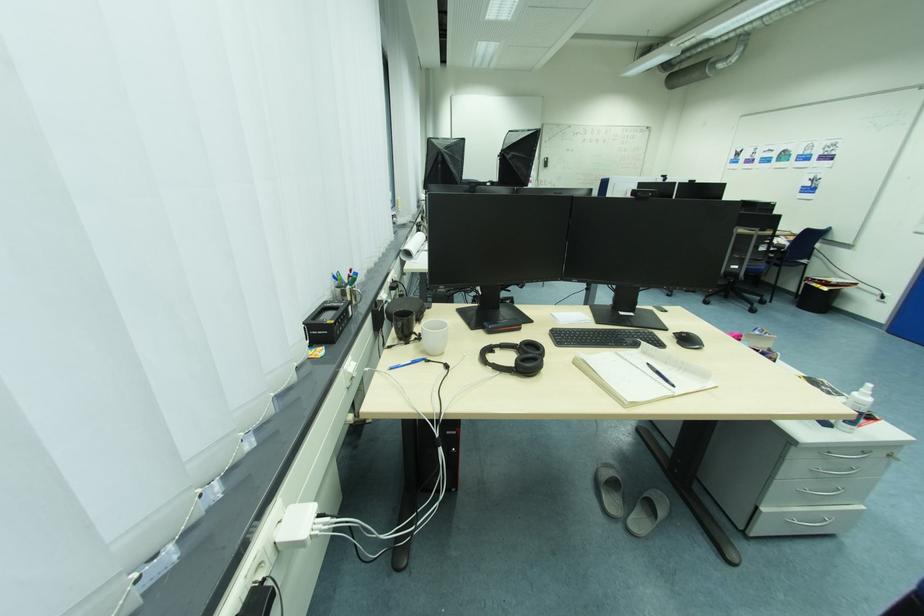
Find where to wear the black headphones. Please return your answer as a coordinate pair (x, y).

(516, 357)